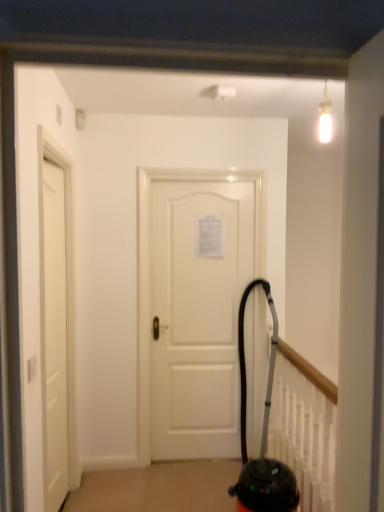
Question: Based on their positions, is white matte door at left, which is the second door from back to front, located to the left or right of black rubber vacuum cleaner at center?

Choices:
 (A) right
 (B) left

Answer: (B)

Question: Would you say white matte door at left, which is counted as the 1th door, starting from the left, is inside or outside black rubber vacuum cleaner at center?

Choices:
 (A) outside
 (B) inside

Answer: (A)

Question: Which is farther from the white matte door at center, the first door viewed from the back?

Choices:
 (A) white matte door at left, which is counted as the 1th door, starting from the left
 (B) black rubber vacuum cleaner at center

Answer: (A)

Question: Estimate the real-world distances between objects in this image. Which object is farther from the white matte door at left, which is counted as the 1th door, starting from the left?

Choices:
 (A) white matte door at center, acting as the first door starting from the right
 (B) black rubber vacuum cleaner at center

Answer: (B)